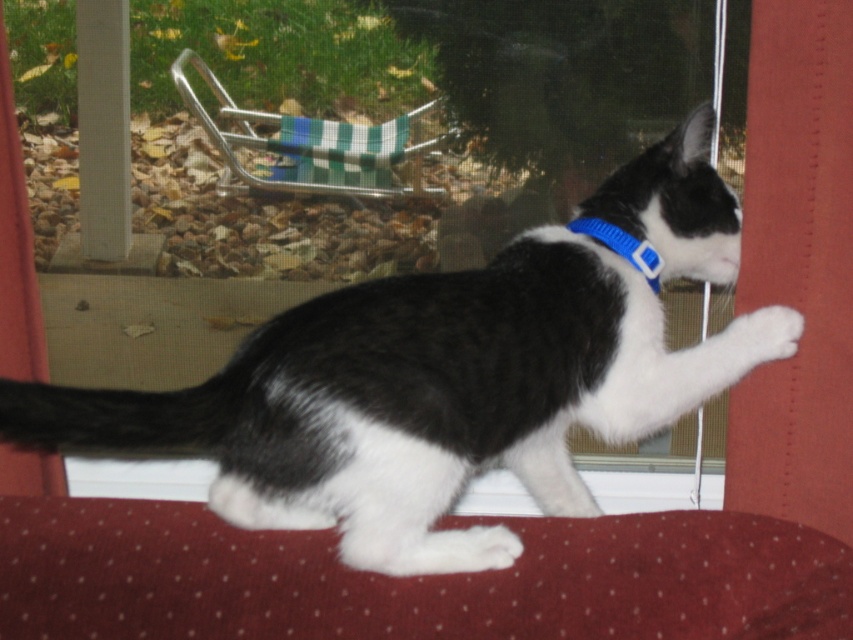
You are a person who is 5.5 feet tall and want to sit on the green checkered fabric chair at upper center. Can you comfortably sit on it without needing to move closer to it?

The distance between you and the green checkered fabric chair at upper center is 4.36 feet. Since you are 5.5 feet tall, you can comfortably sit on it without needing to move closer as the distance is sufficient.